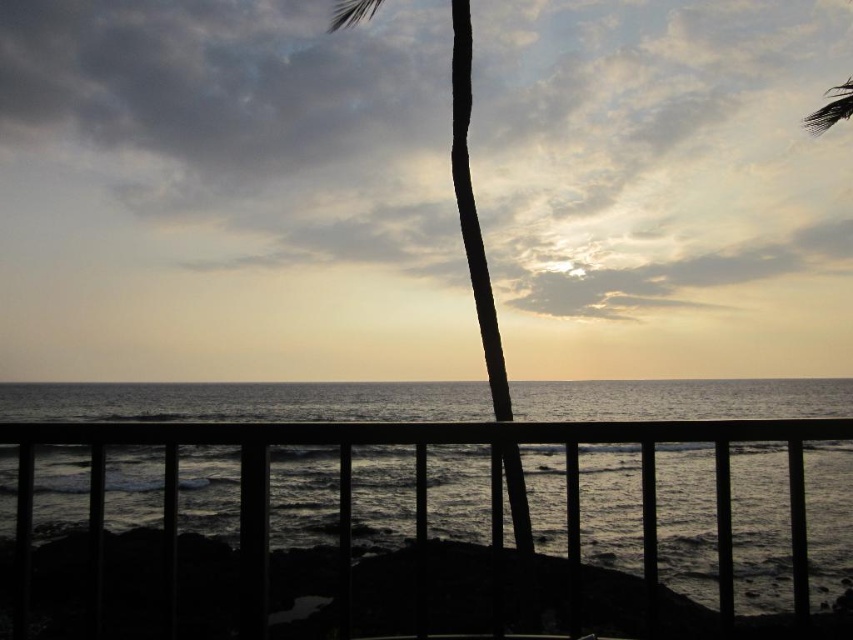
Question: Is black wooden railing at center smaller than silhouette wood palm tree at center?

Choices:
 (A) yes
 (B) no

Answer: (A)

Question: Does black wooden railing at center have a larger size compared to silhouette wood palm tree at center?

Choices:
 (A) yes
 (B) no

Answer: (B)

Question: Which point is farther to the camera?

Choices:
 (A) black wooden railing at center
 (B) silhouette wood palm tree at center

Answer: (B)

Question: Which point is closer to the camera taking this photo?

Choices:
 (A) (502, 413)
 (B) (50, 433)

Answer: (B)

Question: Where is black wooden railing at center located in relation to silhouette wood palm tree at center in the image?

Choices:
 (A) left
 (B) right

Answer: (A)